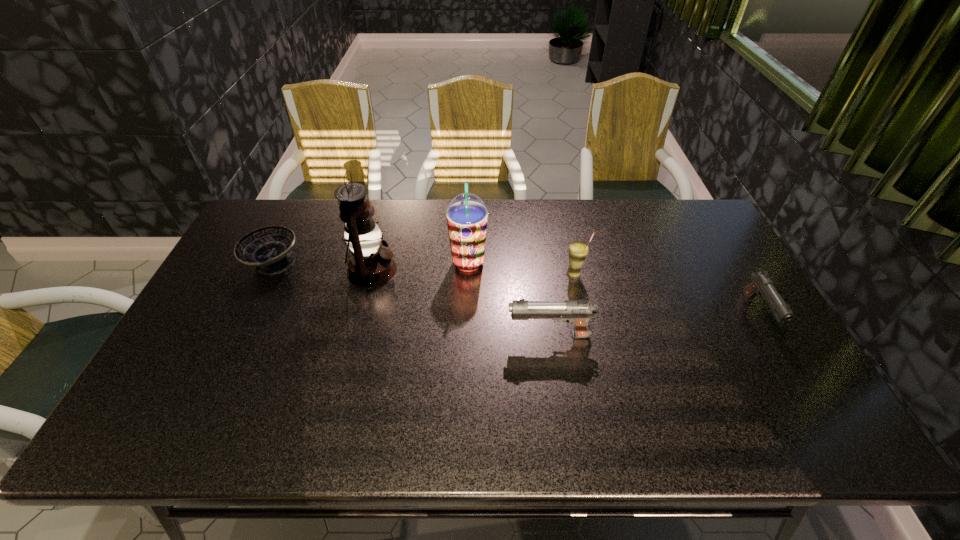
The image size is (960, 540). Identify the location of smoothie. (467, 215).

This screenshot has height=540, width=960. I want to click on free location located 0.090m in the direction the taller gun is aimed, so click(473, 335).

The image size is (960, 540). I want to click on blank space located 0.200m in the direction the taller gun is aimed, so click(x=432, y=335).

Identify the location of vacant region located in the direction the taller gun is aimed. This screenshot has width=960, height=540. (361, 335).

Where is `blank space located 0.060m in the direction the right gun is aimed`? The width and height of the screenshot is (960, 540). blank space located 0.060m in the direction the right gun is aimed is located at coordinates (784, 360).

The width and height of the screenshot is (960, 540). Identify the location of vacant area situated on the front of the straw for drinking. (601, 402).

Locate an element on the screen. The image size is (960, 540). free space located 0.380m on the side of the tallest object, there is a wick adjustment knob is located at coordinates (520, 270).

This screenshot has width=960, height=540. I want to click on vacant area situated 0.250m on the back of the leftmost object, so click(x=303, y=200).

You are a GUI agent. You are given a task and a screenshot of the screen. Output one action in this format:
    pyautogui.click(x=<x>, y=<y>)
    Task: Click on the free space located on the front of the smoothie
    The image size is (960, 540).
    Given the screenshot: What is the action you would take?
    pyautogui.click(x=465, y=384)

Find the location of `object located at the left edge`. object located at the left edge is located at coordinates (269, 248).